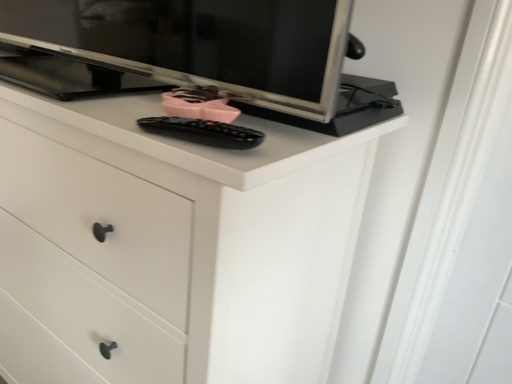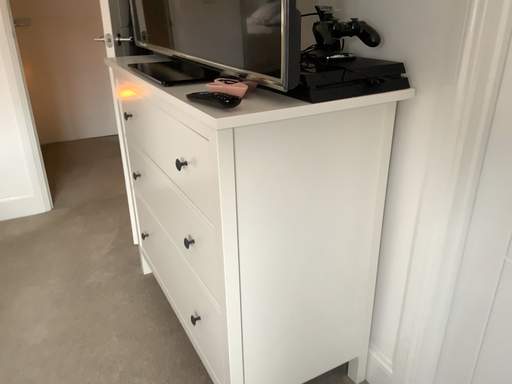
Question: How did the camera likely rotate when shooting the video?

Choices:
 (A) rotated left
 (B) rotated right

Answer: (A)